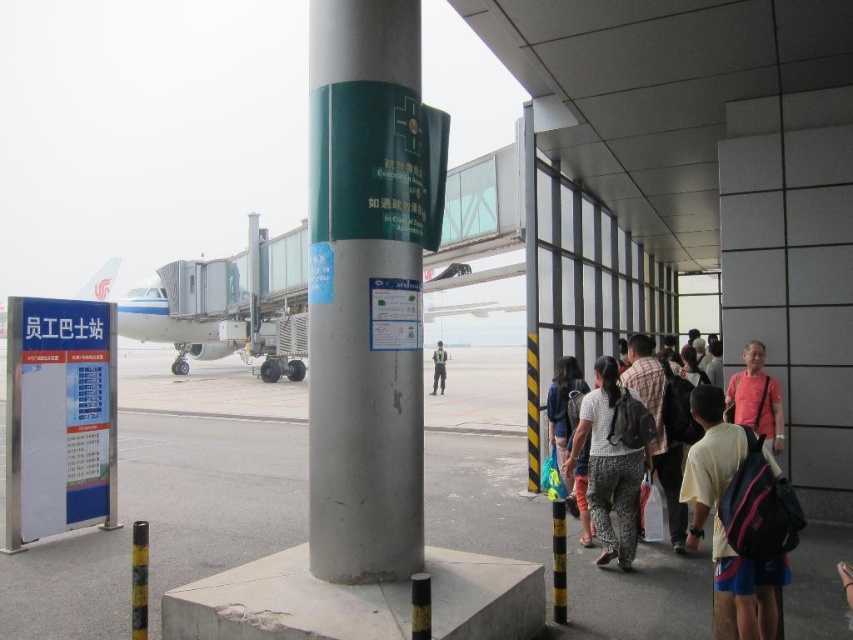
Can you confirm if light yellow fabric shirt at lower right is bigger than dark gray uniform at center?

No.

Is light yellow fabric shirt at lower right to the left of dark gray uniform at center from the viewer's perspective?

In fact, light yellow fabric shirt at lower right is to the right of dark gray uniform at center.

Who is more distant from viewer, (680, 493) or (433, 364)?

Positioned behind is point (433, 364).

Identify the location of light yellow fabric shirt at lower right. The width and height of the screenshot is (853, 640). (723, 529).

Between point (361, 410) and point (759, 422), which one is positioned behind?

The point (759, 422) is more distant.

Does silver metallic pole at center appear under red cotton shirt at center-right?

No.

Is point (415, 449) less distant than point (766, 372)?

Yes, point (415, 449) is closer to viewer.

Where is `silver metallic pole at center`? Image resolution: width=853 pixels, height=640 pixels. silver metallic pole at center is located at coordinates (364, 296).

Who is positioned more to the right, gray asphalt tarmac at center or light brown backpack at center?

From the viewer's perspective, light brown backpack at center appears more on the right side.

Is point (154, 465) closer to viewer compared to point (596, 381)?

No, it is not.

Locate an element on the screen. The width and height of the screenshot is (853, 640). gray asphalt tarmac at center is located at coordinates (170, 499).